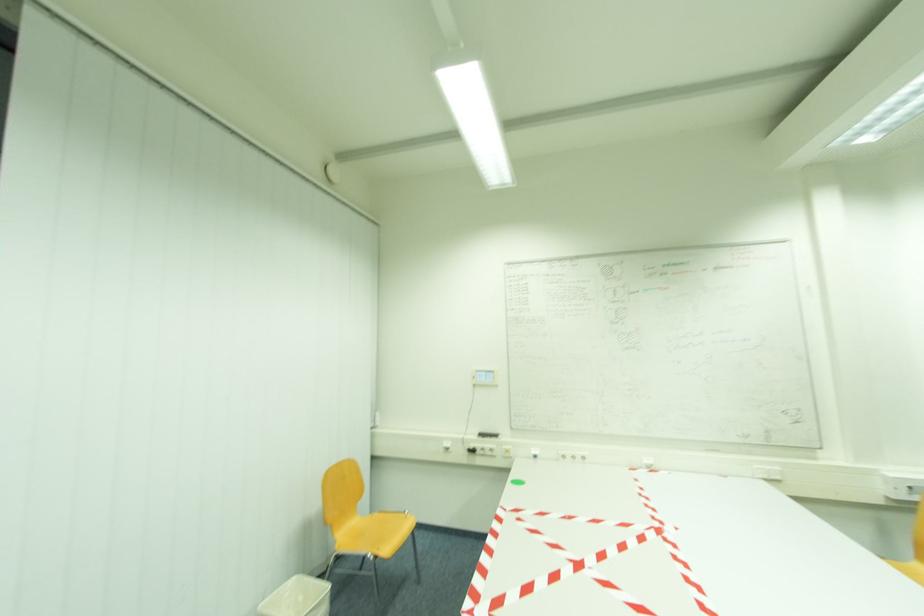
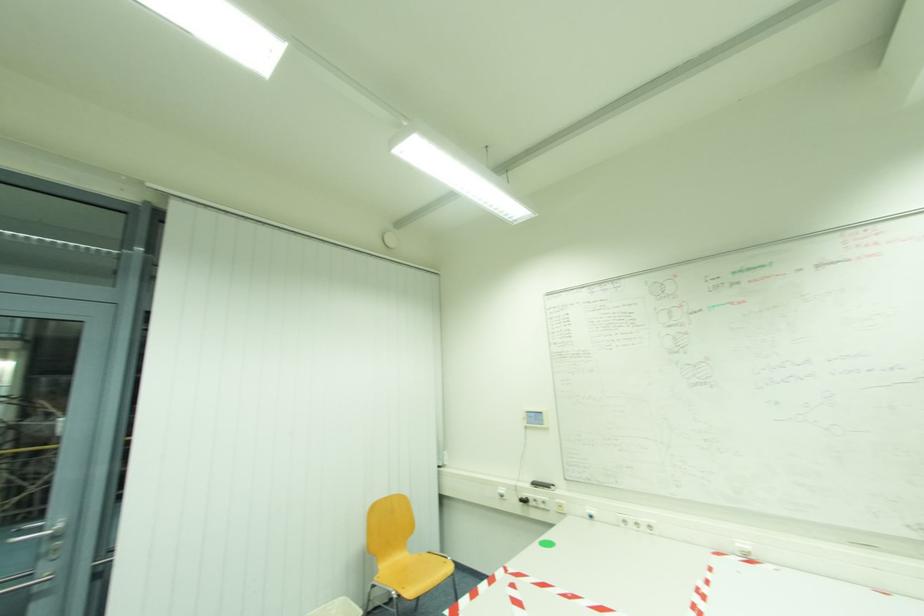
Question: In a continuous first-person perspective shot, in which direction is the camera moving?

Choices:
 (A) Left
 (B) Right
 (C) Forward
 (D) Backward

Answer: (B)